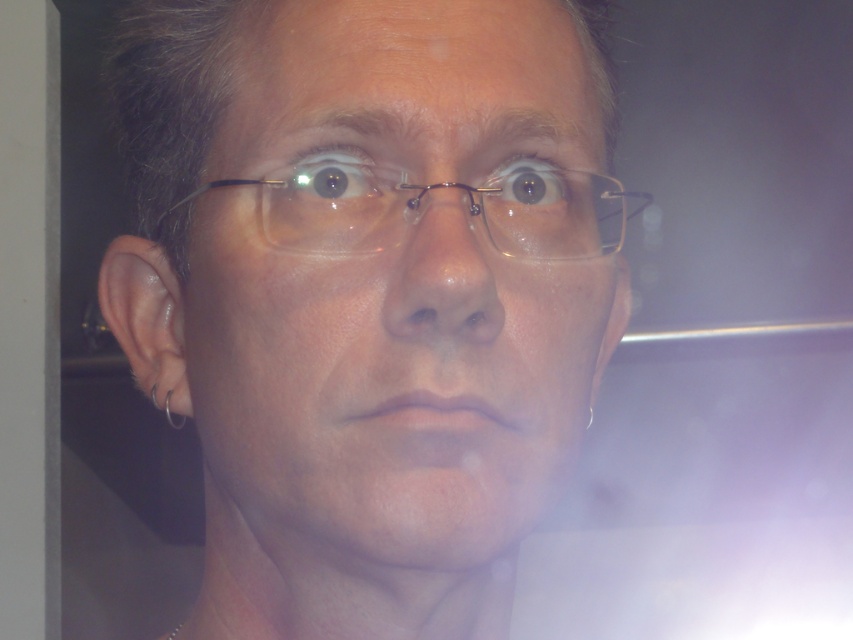
Where is the matte glass face at center located in the image?

The matte glass face at center is located at point (387, 384).

You are a photographer adjusting your camera settings to capture the person in the image. You notice the matte glass face at center and the brown glossy eye at center. Which object should you focus on to ensure the reflection in the lower right corner is properly captured?

The matte glass face at center is to the left of the brown glossy eye at center. To properly capture the reflection in the lower right corner, focus on the brown glossy eye at center since it is closer to the reflection area.

You are a photographer adjusting your camera settings to capture a detailed closeup of the matte glass eye at upper center. Considering the distance between you and the eye, what is the minimum focal length you should use to ensure sharp focus?

The minimum focal length required would depend on the camera sensor size and desired depth of field, but since the matte glass eye at upper center is 13.73 inches away, a longer focal length like 85mm or 100mm would be advisable for portrait photography to avoid distortion and maintain sharp focus at that close proximity.